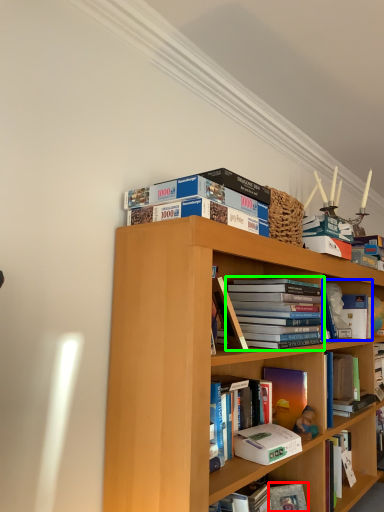
Question: Considering the real-world distances, which object is closest to paperback book (highlighted by a red box)? book (highlighted by a blue box) or book (highlighted by a green box).

Choices:
 (A) book
 (B) book

Answer: (B)